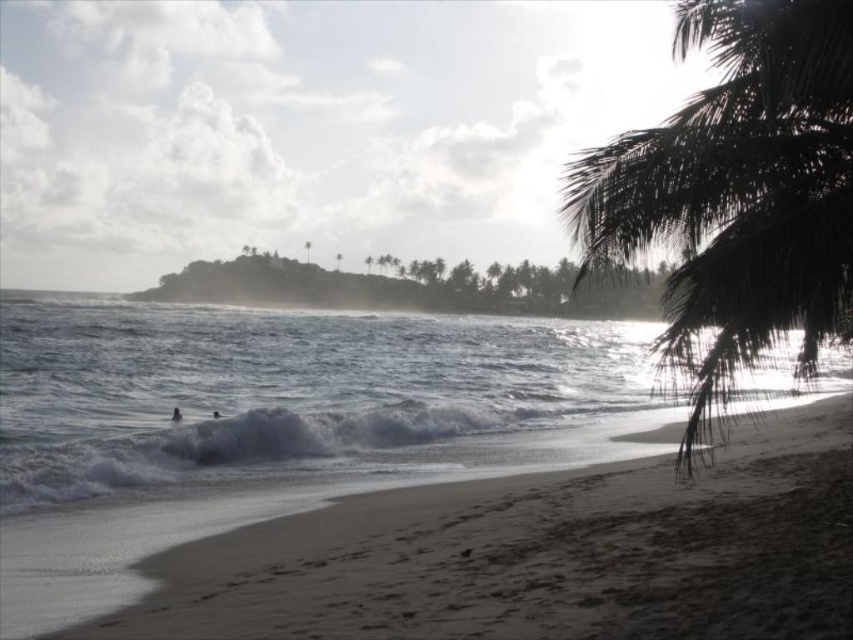
Question: Can you confirm if dark green leafy palm tree at right is wider than green leafy palm tree at center?

Choices:
 (A) no
 (B) yes

Answer: (B)

Question: Is dark skin person at lower left to the left of green leafy palm tree at center from the viewer's perspective?

Choices:
 (A) yes
 (B) no

Answer: (B)

Question: From the image, what is the correct spatial relationship of dark green leafy palm tree at right in relation to green leafy palm tree at center?

Choices:
 (A) above
 (B) below

Answer: (B)

Question: Which of the following is the farthest from the observer?

Choices:
 (A) (467, 496)
 (B) (171, 417)
 (C) (647, 220)
 (D) (311, 244)

Answer: (D)

Question: Which of the following is the farthest from the observer?

Choices:
 (A) (306, 259)
 (B) (808, 449)

Answer: (A)

Question: Which object is the farthest from the dark green leafy palm tree at right?

Choices:
 (A) green leafy palm tree at center
 (B) white frothy water at lower left
 (C) white sandy beach at lower left
 (D) dark skin person at lower left

Answer: (A)